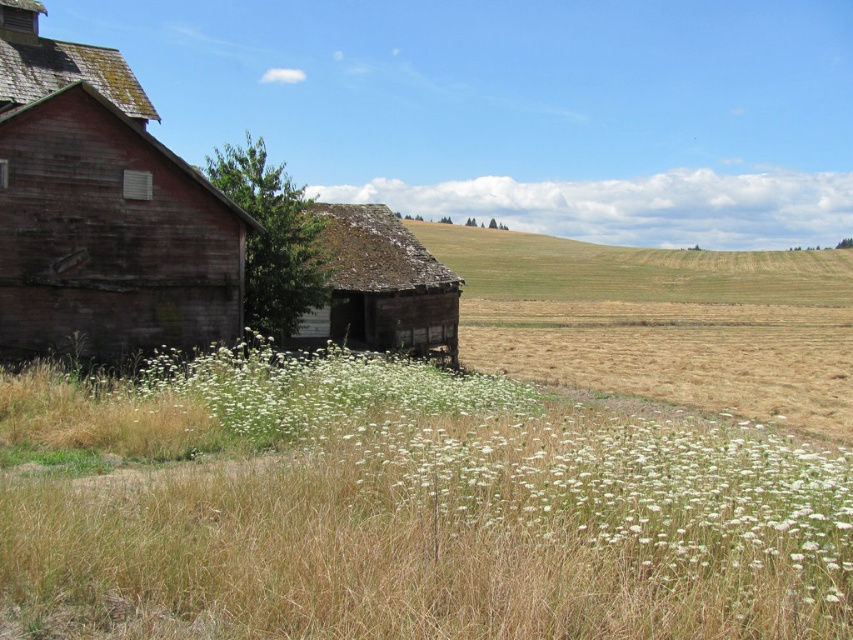
Which is above, white fluffy flowers at center or rusty wood hut at center?

rusty wood hut at center is above.

Can you confirm if white fluffy flowers at center is positioned above rusty wood hut at center?

Actually, white fluffy flowers at center is below rusty wood hut at center.

Locate an element on the screen. This screenshot has height=640, width=853. white fluffy flowers at center is located at coordinates (535, 467).

What are the coordinates of `white fluffy flowers at center` in the screenshot? It's located at (535, 467).

Can you confirm if rustic wooden barn at left is positioned above rusty wood hut at center?

Yes, rustic wooden barn at left is above rusty wood hut at center.

Is rustic wooden barn at left taller than rusty wood hut at center?

Indeed, rustic wooden barn at left has a greater height compared to rusty wood hut at center.

I want to click on rustic wooden barn at left, so click(x=102, y=211).

Who is more forward, (682, 433) or (132, 77)?

Point (682, 433) is more forward.

What do you see at coordinates (535, 467) in the screenshot? I see `white fluffy flowers at center` at bounding box center [535, 467].

Find the location of a particular element. The width and height of the screenshot is (853, 640). white fluffy flowers at center is located at coordinates (535, 467).